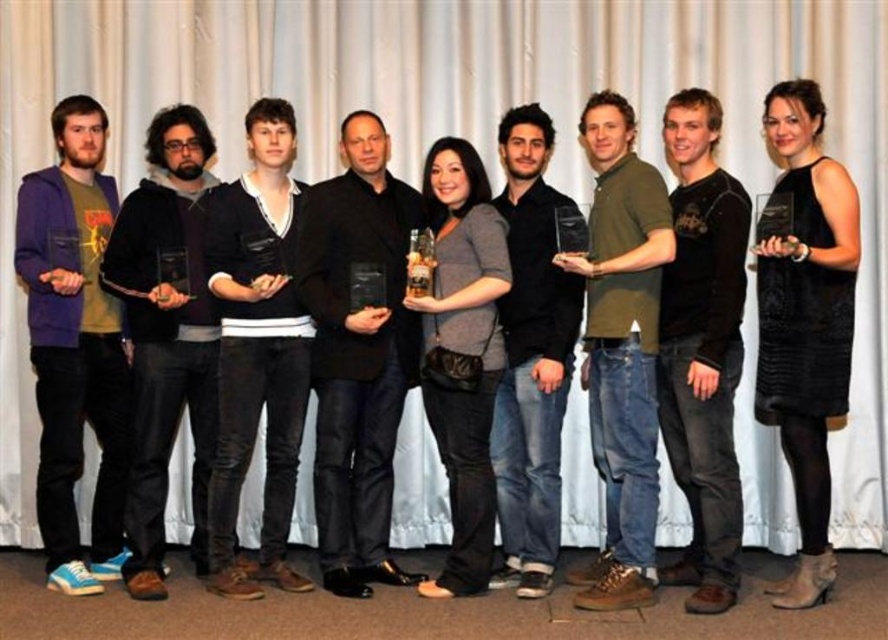
You are organizing a charity event and need to decide which of the two items, the purple fleece jacket at left or the black matte shirt at center, can be displayed on a small mannequin that can only accommodate larger clothing items. Which item should you choose?

The purple fleece jacket at left is larger in size than the black matte shirt at center, so you should choose the purple fleece jacket at left for the small mannequin that requires larger clothing items.

From the picture: You are a photographer taking a group photo of the nine people in the scene. You need to ensure that the black matte shirt at center and the green matte shirt at center are at least 10 inches apart for better visibility. Based on the current positioning, will you need to adjust their positions?

The black matte shirt at center and green matte shirt at center are currently 8.96 inches apart, which is less than the required 10 inches. Therefore, you will need to adjust their positions to increase the distance between them.